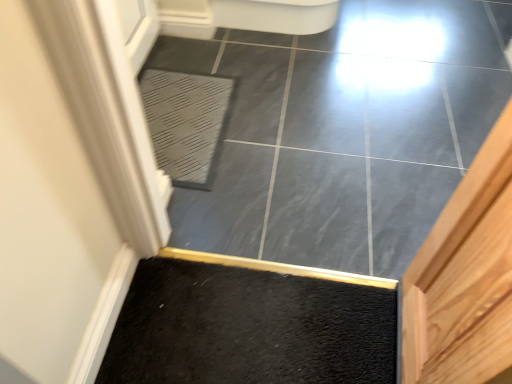
Identify the location of free space to the right of gray textured bath mat at center. The image size is (512, 384). (281, 130).